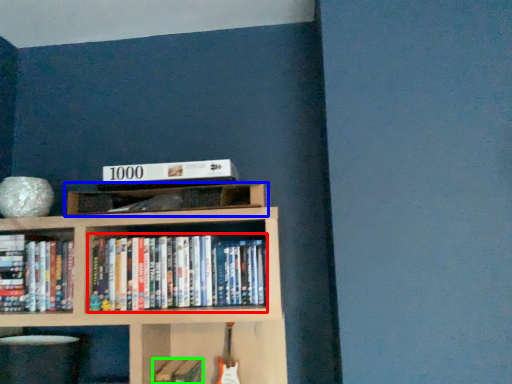
Question: Estimate the real-world distances between objects in this image. Which object is farther from book (highlighted by a red box), shelf (highlighted by a blue box) or book (highlighted by a green box)?

Choices:
 (A) shelf
 (B) book

Answer: (B)